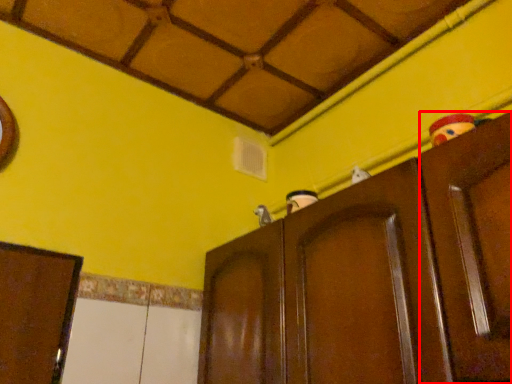
Question: Considering the relative positions of door (annotated by the red box) and cupboard in the image provided, where is door (annotated by the red box) located with respect to the staircase?

Choices:
 (A) right
 (B) left

Answer: (A)